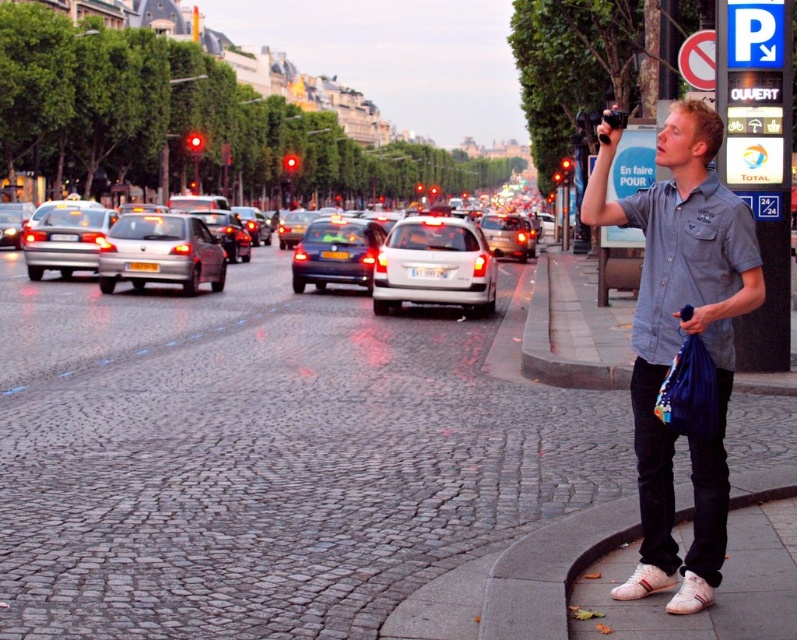
Question: Which is nearer to the cobblestone pavement at center?

Choices:
 (A) silver metallic sedan at center-left
 (B) matte silver sedan at left
 (C) silver metallic sedan at center

Answer: (B)

Question: Can you confirm if satin silver sedan at left is thinner than silver metallic sedan at center-left?

Choices:
 (A) no
 (B) yes

Answer: (A)

Question: Can you confirm if cobblestone pavement at center is positioned to the left of shiny silver sedan at center?

Choices:
 (A) yes
 (B) no

Answer: (B)

Question: Does silver metallic sedan at center come behind matte silver sedan at center?

Choices:
 (A) no
 (B) yes

Answer: (A)

Question: Which of the following is the closest to the observer?

Choices:
 (A) white matte hatchback at center
 (B) satin silver sedan at left
 (C) matte silver sedan at left

Answer: (A)

Question: Which object is positioned closest to the white matte hatchback at center?

Choices:
 (A) cobblestone pavement at center
 (B) silver metallic sedan at center
 (C) silver metallic sedan at center-left
 (D) shiny silver sedan at center

Answer: (D)